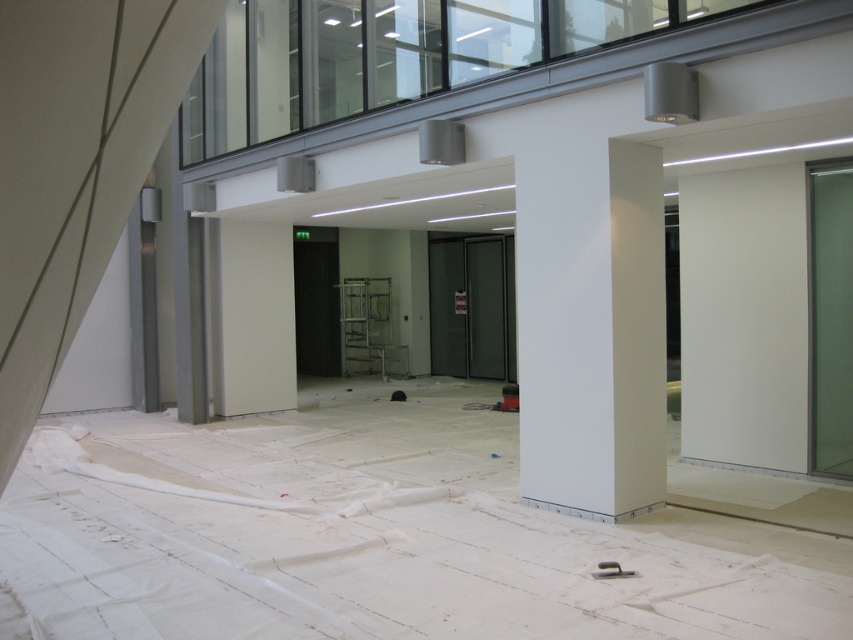
Is point (463, 260) farther from camera compared to point (360, 340)?

No, it is in front of (360, 340).

Which is in front, point (495, 336) or point (341, 312)?

Point (495, 336)

The height and width of the screenshot is (640, 853). I want to click on transparent glass door at center, so click(473, 307).

Does green frosted glass door at right appear under transparent glass door at center?

Correct, green frosted glass door at right is located below transparent glass door at center.

Does green frosted glass door at right have a smaller size compared to transparent glass door at center?

Yes, green frosted glass door at right is smaller than transparent glass door at center.

Does point (850, 273) lie behind point (502, 284)?

No, (850, 273) is closer to viewer.

Where is `green frosted glass door at right`? green frosted glass door at right is located at coordinates (830, 317).

Measure the distance from white smooth column at center to metallic silver ladder at center.

white smooth column at center and metallic silver ladder at center are 34.41 feet apart from each other.

Does white smooth column at center have a larger size compared to metallic silver ladder at center?

Actually, white smooth column at center might be smaller than metallic silver ladder at center.

At what (x,y) coordinates should I click in order to perform the action: click on white smooth column at center. Please return your answer as a coordinate pair (x, y). Looking at the image, I should click on (590, 326).

The image size is (853, 640). I want to click on white smooth column at center, so click(590, 326).